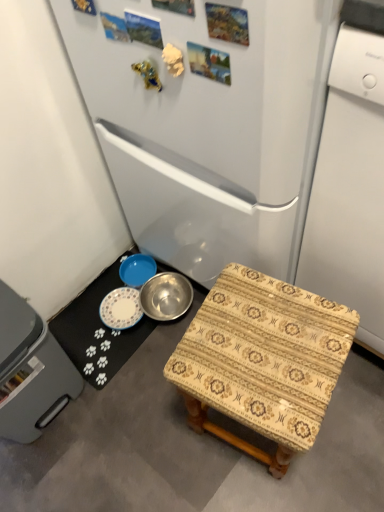
Where is `vacant area on top of patterned fabric stool at lower right (from a real-world perspective)`? The width and height of the screenshot is (384, 512). vacant area on top of patterned fabric stool at lower right (from a real-world perspective) is located at coordinates (264, 343).